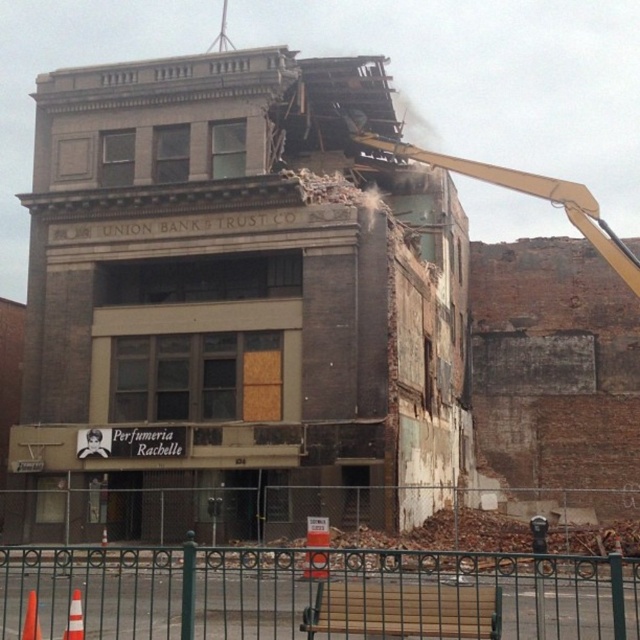
Does green metal fence at lower center have a smaller size compared to white plastic construction worker at center?

No, green metal fence at lower center is not smaller than white plastic construction worker at center.

Image resolution: width=640 pixels, height=640 pixels. What do you see at coordinates (312, 593) in the screenshot? I see `green metal fence at lower center` at bounding box center [312, 593].

At what (x,y) coordinates should I click in order to perform the action: click on green metal fence at lower center. Please return your answer as a coordinate pair (x, y). The height and width of the screenshot is (640, 640). Looking at the image, I should click on (312, 593).

How distant is wooden bench at lower center from white plastic construction worker at center?

wooden bench at lower center and white plastic construction worker at center are 66.88 feet apart from each other.

Between wooden bench at lower center and white plastic construction worker at center, which one appears on the left side from the viewer's perspective?

Positioned to the left is white plastic construction worker at center.

Locate an element on the screen. The image size is (640, 640). wooden bench at lower center is located at coordinates (404, 611).

Can you confirm if green metal fence at lower center is positioned below wooden bench at lower center?

Yes.

Which is in front, point (141, 564) or point (401, 628)?

Point (401, 628) is in front.

I want to click on green metal fence at lower center, so click(x=312, y=593).